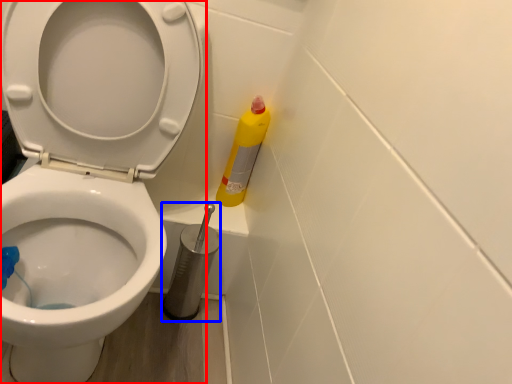
Question: Which object is further to the camera taking this photo, toilet (highlighted by a red box) or brush (highlighted by a blue box)?

Choices:
 (A) toilet
 (B) brush

Answer: (B)